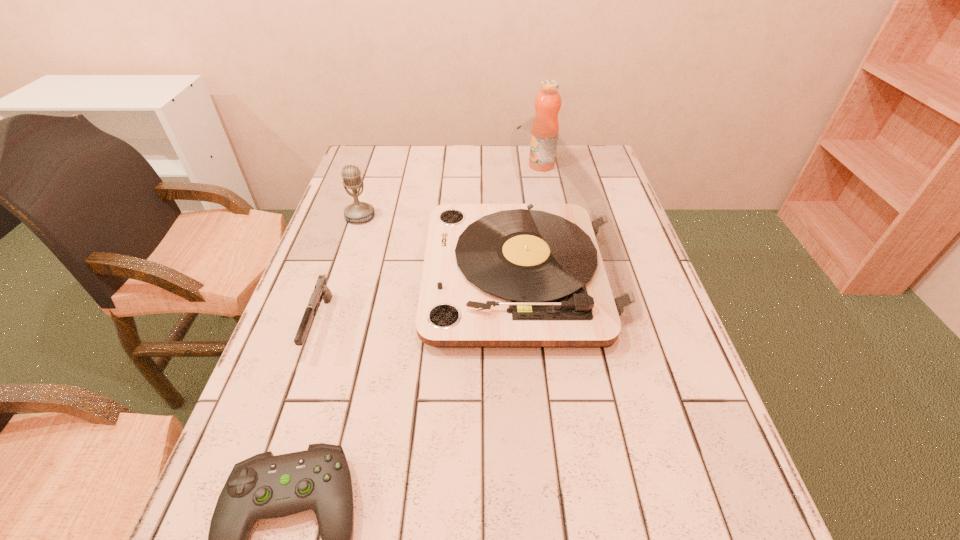
At what (x,y) coordinates should I click in order to perform the action: click on record player. Please return your answer as a coordinate pair (x, y). Looking at the image, I should click on (552, 273).

Locate an element on the screen. This screenshot has width=960, height=540. fruit juice is located at coordinates point(548,102).

Image resolution: width=960 pixels, height=540 pixels. I want to click on the farthest object, so click(548, 102).

Locate an element on the screen. This screenshot has height=540, width=960. microphone is located at coordinates (358, 211).

Where is `gun`? This screenshot has width=960, height=540. gun is located at coordinates (321, 291).

The height and width of the screenshot is (540, 960). Identify the location of free space located 0.110m with the tonearm facing the front of the record player. point(381,277).

Find the location of a particular element. free spot located 0.240m with the tonearm facing the front of the record player is located at coordinates (327, 277).

The image size is (960, 540). In order to click on vacant space located 0.120m with the tonearm facing the front of the record player in this screenshot , I will do `click(376, 277)`.

You are a GUI agent. You are given a task and a screenshot of the screen. Output one action in this format:
    pyautogui.click(x=<x>, y=<y>)
    Task: Click on the vacant area located on the front of the farthest object
    This screenshot has height=540, width=960.
    Given the screenshot: What is the action you would take?
    pyautogui.click(x=557, y=242)

Identify the location of free region located on the front-facing side of the third tallest object. pyautogui.click(x=348, y=256).